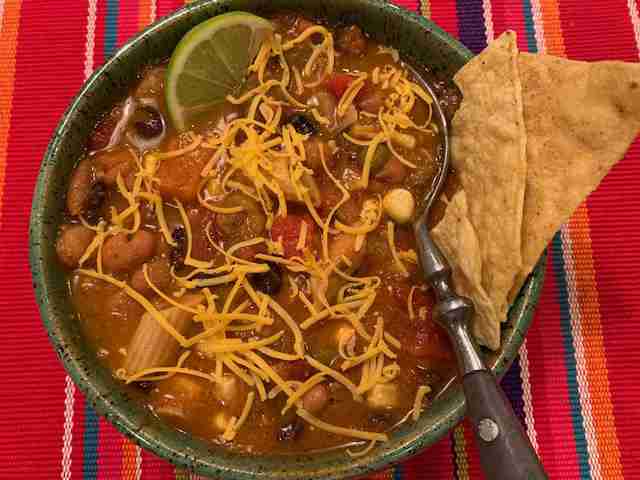
At what (x,y) coordinates should I click in order to perform the action: click on spoon. Please return your answer as a coordinate pair (x, y). The height and width of the screenshot is (480, 640). Looking at the image, I should click on (431, 259).